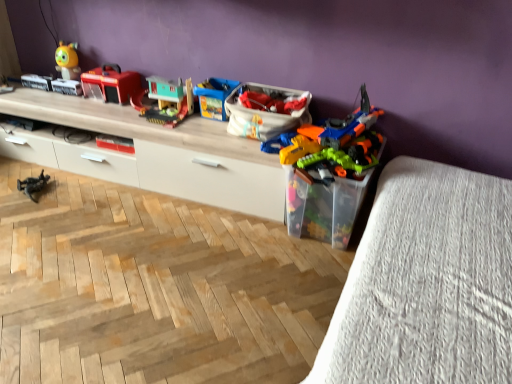
At what (x,y) coordinates should I click in order to perform the action: click on free space to the right of metallic gray toy soldier at lower left, the fifth toy in the right-to-left sequence. Please return your answer as a coordinate pair (x, y). The image size is (512, 384). Looking at the image, I should click on (71, 190).